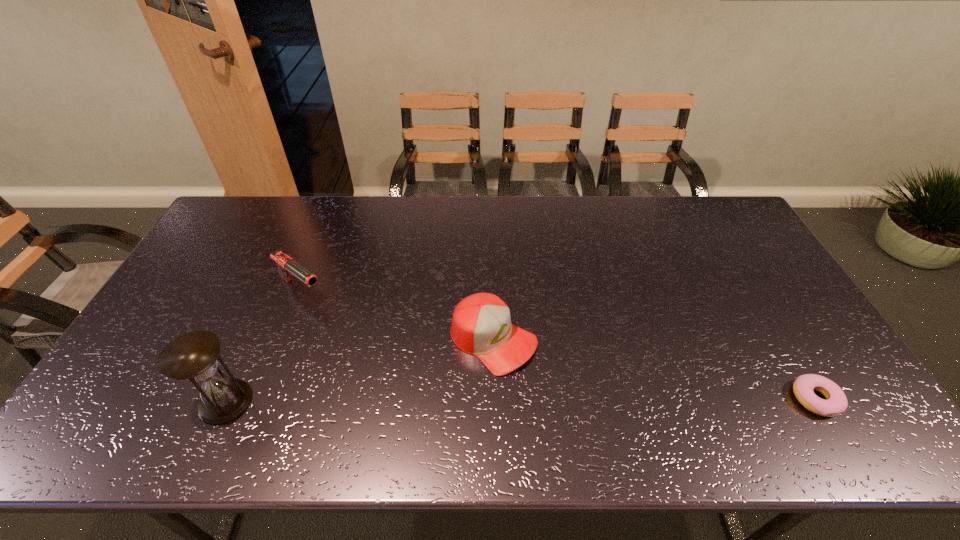
Identify the location of free space on the desktop that is between the tallest object and the shortest object and is positioned at the aiming end of the gun. (447, 401).

Where is `free space on the desktop that is between the hourglass and the doughnut and is positioned on the front-facing side of the baseball cap`? The width and height of the screenshot is (960, 540). free space on the desktop that is between the hourglass and the doughnut and is positioned on the front-facing side of the baseball cap is located at coordinates (579, 400).